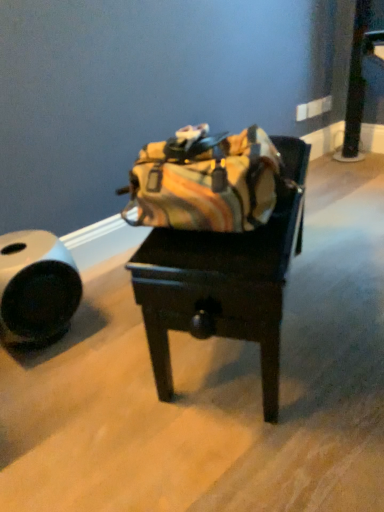
This screenshot has width=384, height=512. I want to click on vacant area that is in front of leather duffel bag at center, so [x=253, y=424].